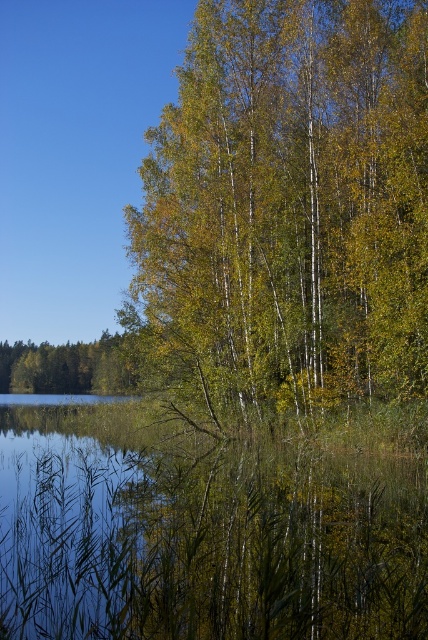
Is transparent water at lower left below green leafy tree at left?

Yes.

Is transparent water at lower left closer to the viewer compared to green leafy tree at left?

Yes, transparent water at lower left is in front of green leafy tree at left.

Is point (20, 518) less distant than point (70, 342)?

Yes, point (20, 518) is in front of point (70, 342).

Where is `transparent water at lower left`? transparent water at lower left is located at coordinates (70, 525).

Is point (202, 100) farther from camera compared to point (74, 353)?

No, it is in front of (74, 353).

Between point (418, 284) and point (110, 376), which one is positioned in front?

Point (418, 284) is in front.

Identify the location of green matte tree at center. Image resolution: width=428 pixels, height=640 pixels. (288, 211).

Does green matte tree at center appear over transparent water at lower left?

Indeed, green matte tree at center is positioned over transparent water at lower left.

Can you confirm if green matte tree at center is taller than transparent water at lower left?

Yes.

Is point (415, 13) positioned in front of point (6, 636)?

No, (415, 13) is further to viewer.

I want to click on green matte tree at center, so click(x=288, y=211).